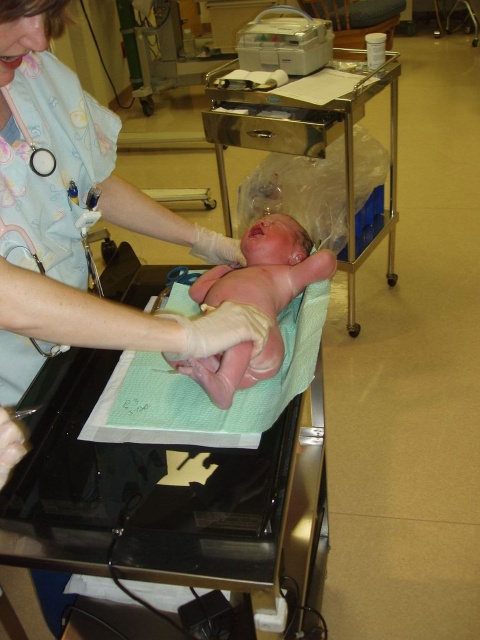
Does stainless steel cart at upper center have a lesser height compared to pink smooth newborn at center?

No, stainless steel cart at upper center is not shorter than pink smooth newborn at center.

Consider the image. Between stainless steel cart at upper center and pink smooth newborn at center, which one appears on the right side from the viewer's perspective?

Positioned to the right is stainless steel cart at upper center.

The width and height of the screenshot is (480, 640). Describe the element at coordinates (312, 147) in the screenshot. I see `stainless steel cart at upper center` at that location.

The image size is (480, 640). In order to click on stainless steel cart at upper center in this screenshot , I will do `click(312, 147)`.